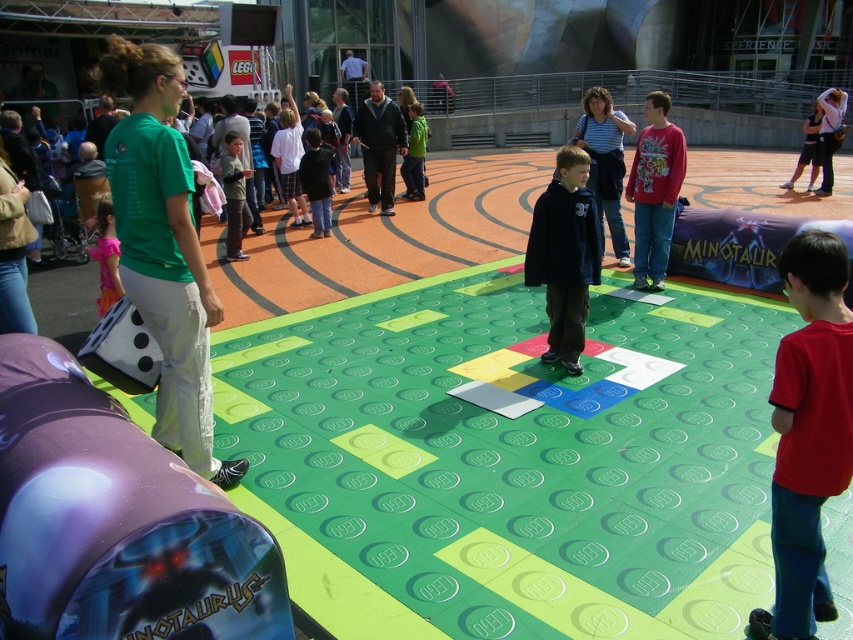
Which is more to the left, dark blue sweater at center or striped cotton shirt at center?

dark blue sweater at center

I want to click on dark blue sweater at center, so click(564, 256).

At what (x,y) coordinates should I click in order to perform the action: click on dark blue sweater at center. Please return your answer as a coordinate pair (x, y). This screenshot has height=640, width=853. Looking at the image, I should click on (564, 256).

Can you confirm if red matte shirt at lower right is positioned below striped cotton shirt at center?

Correct, red matte shirt at lower right is located below striped cotton shirt at center.

Which is above, red matte shirt at lower right or striped cotton shirt at center?

striped cotton shirt at center is higher up.

Where is `red matte shirt at lower right`? The image size is (853, 640). red matte shirt at lower right is located at coordinates click(x=808, y=433).

Can you confirm if dark blue sweater at center is thinner than red cotton shirt at center?

No, dark blue sweater at center is not thinner than red cotton shirt at center.

Does dark blue sweater at center have a greater width compared to red cotton shirt at center?

Indeed, dark blue sweater at center has a greater width compared to red cotton shirt at center.

At what (x,y) coordinates should I click in order to perform the action: click on dark blue sweater at center. Please return your answer as a coordinate pair (x, y). This screenshot has height=640, width=853. Looking at the image, I should click on (564, 256).